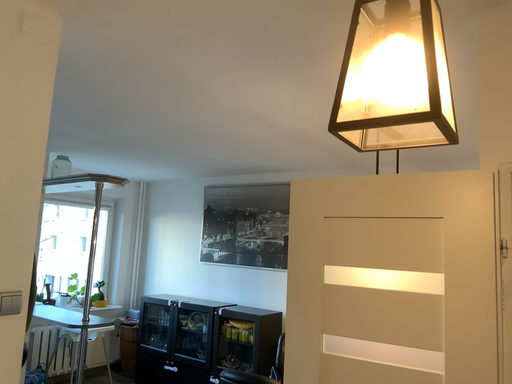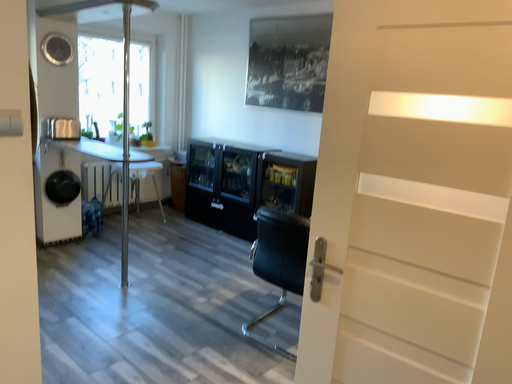
Question: Which way did the camera rotate in the video?

Choices:
 (A) rotated left
 (B) rotated right

Answer: (A)